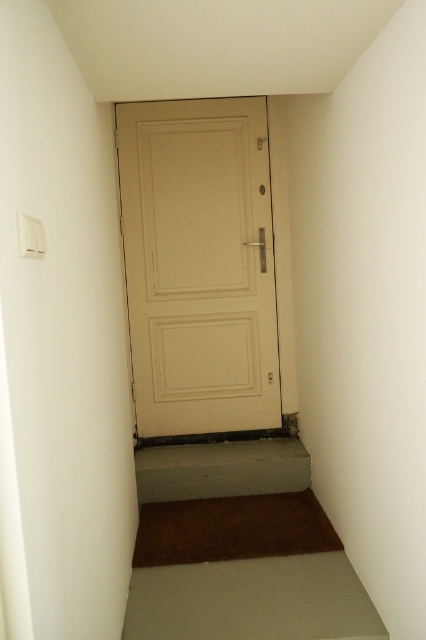
You are a delivery person carrying a large box and need to enter through the beige matte door at center. The box is 2 meters tall. Can you safely step over the brown carpet at lower center to reach the door?

The beige matte door at center is further to the viewer than the brown carpet at lower center. Since the door is closer to you, you can safely step over the brown carpet at lower center to reach it. However, the box is 2 meters tall, so ensure there is enough vertical clearance in the corridor to avoid hitting the ceiling.

You are moving a large painting that is 1.2 meters wide. You are standing in the corridor and want to move it through the beige matte door at center and the brown carpet at lower center. Which object should you avoid to prevent the painting from getting damaged?

You should avoid the brown carpet at lower center because the beige matte door at center is positioned on the left side of brown carpet at lower center, meaning the carpet is in the path of the painting and could cause damage if dragged over it.